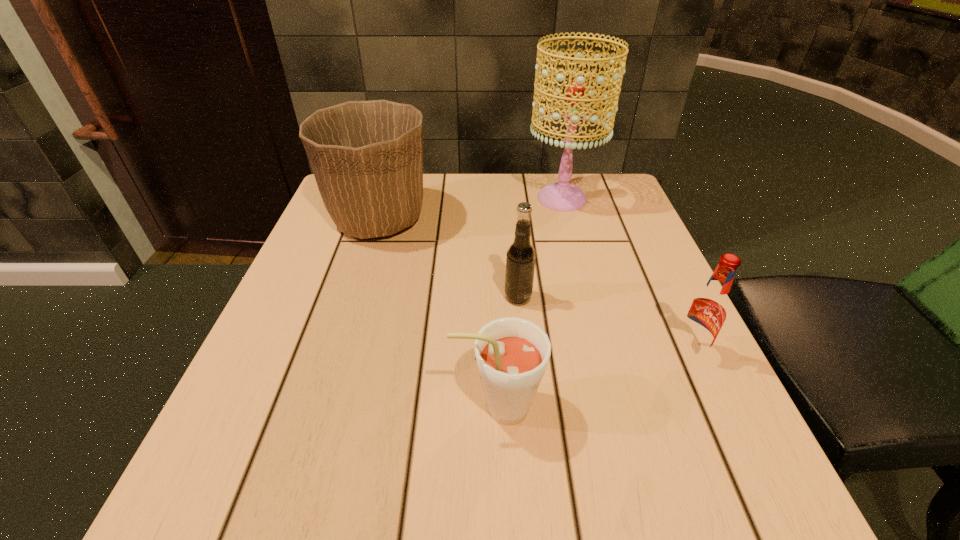
Where is `free space between the lampshade and the third farthest object`? This screenshot has width=960, height=540. free space between the lampshade and the third farthest object is located at coordinates (540, 248).

Select which object is the fourth closest to the nearest root beer. Please provide its 2D coordinates. Your answer should be formatted as a tuple, i.e. [(x, y)], where the tuple contains the x and y coordinates of a point satisfying the conditions above.

[(561, 196)]

Identify which object is the second closest to the nearest object. Please provide its 2D coordinates. Your answer should be formatted as a tuple, i.e. [(x, y)], where the tuple contains the x and y coordinates of a point satisfying the conditions above.

[(706, 313)]

Find the location of a particular element. root beer that stands as the second closest to the nearest root beer is located at coordinates (706, 313).

Select which root beer appears as the closest to the nearest object. Please provide its 2D coordinates. Your answer should be formatted as a tuple, i.e. [(x, y)], where the tuple contains the x and y coordinates of a point satisfying the conditions above.

[(520, 260)]

You are a GUI agent. You are given a task and a screenshot of the screen. Output one action in this format:
    pyautogui.click(x=<x>, y=<y>)
    Task: Click on the vacant area in the image that satisfies the following two spatial constraints: 1. on the front side of the second object from right to left; 2. on the drink side of the nearest object
    
    Given the screenshot: What is the action you would take?
    pyautogui.click(x=617, y=407)